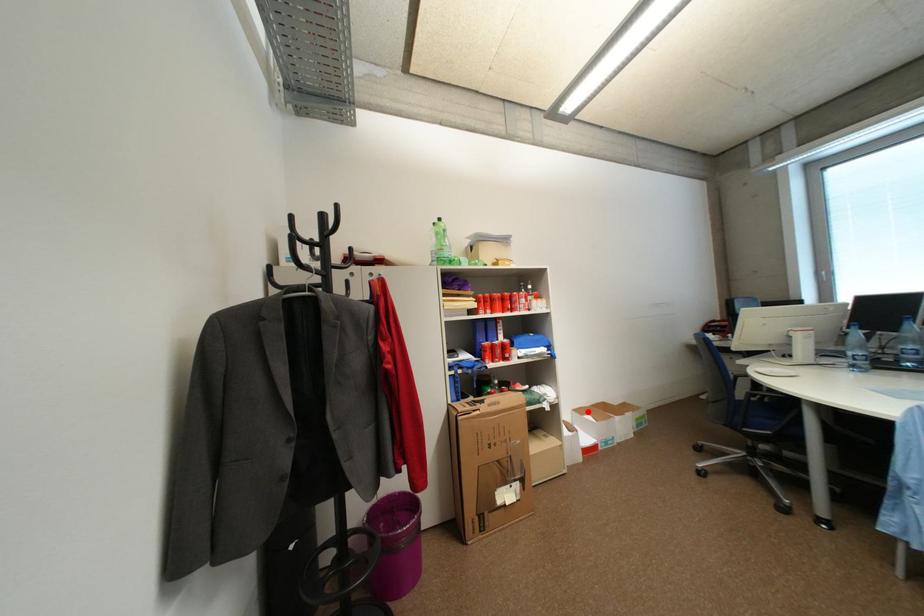
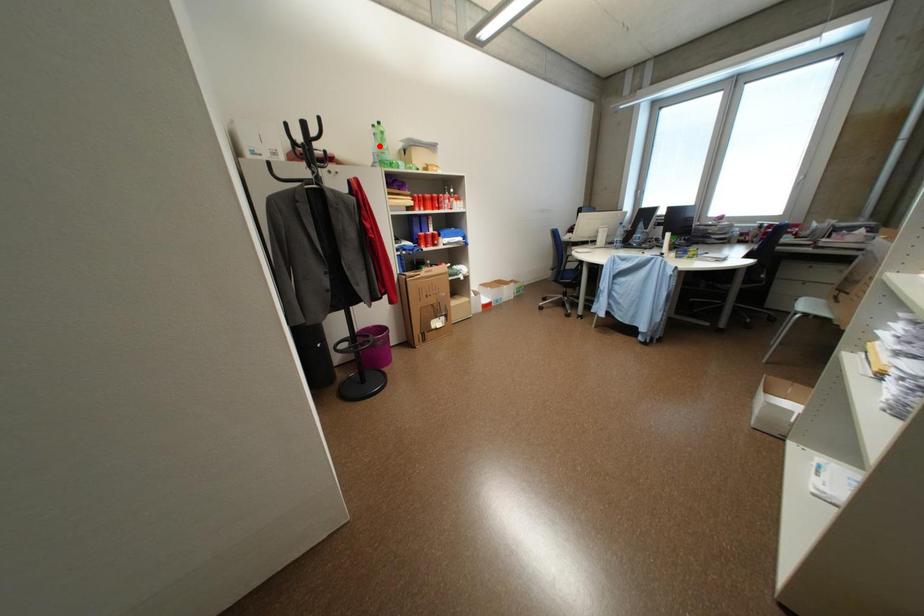
I am providing you with two images of the same scene from different viewpoints. A red point is marked on the first image and another point is marked on the second image. Do the highlighted points in image1 and image2 indicate the same real-world spot?

No